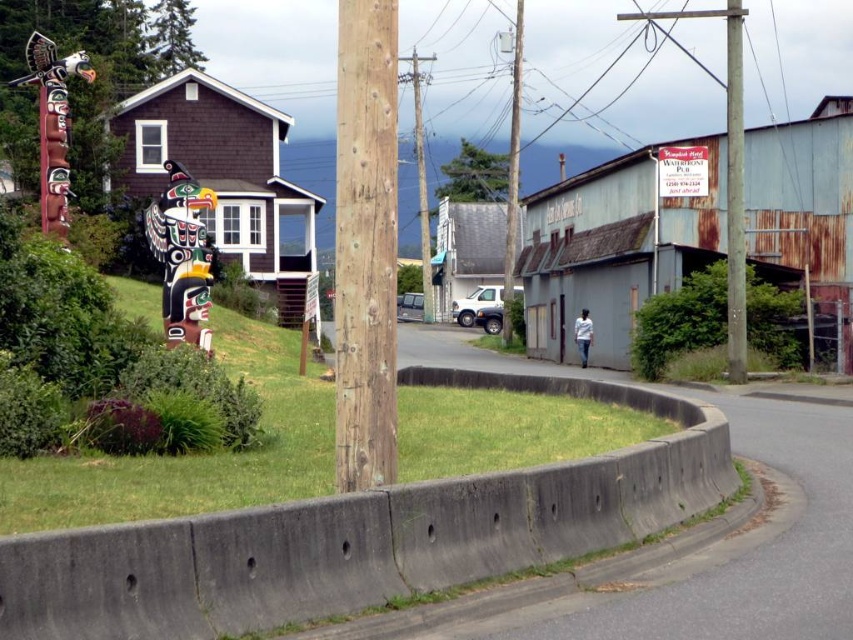
You are standing at the camera position and want to walk to both points. Which point should you reach first, point (393, 385) or point (735, 285)?

You will reach point (393, 385) first because it is closer to the camera than point (735, 285).

You are a painter standing at the edge of the road looking towards the two poles. Which pole will appear closer to you, the smooth wooden pole at center or the smooth wooden telegraph pole at center?

The smooth wooden pole at center will appear closer because it is positioned in front of the smooth wooden telegraph pole at center.

You are standing on the grassy area near the concrete curb. You want to take a photo of the rustic wooden totem pole at center and the smooth wooden telegraph pole at center. Which one will appear closer to the camera in the photo?

The rustic wooden totem pole at center will appear closer to the camera in the photo because it is positioned in front of the smooth wooden telegraph pole at center.